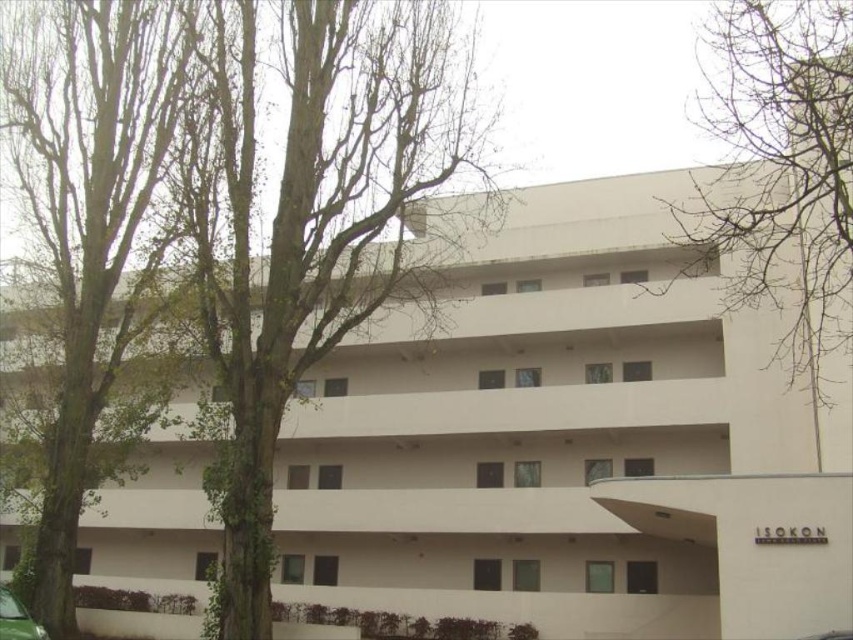
From the picture: You are standing in front of the modern architectural building and notice a point marked at coordinates (781, 164). What does this point indicate?

The point at coordinates (781, 164) marks the location of bare branches at the upper right of the image.

You are standing at point (308,225) in the image. What do you see around you?

You see a green leafy tree at left around you.